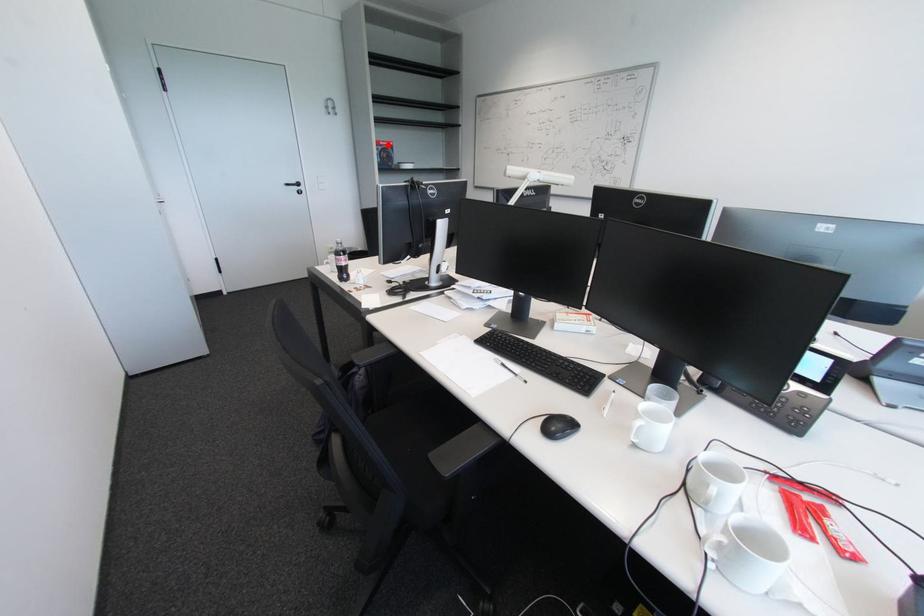
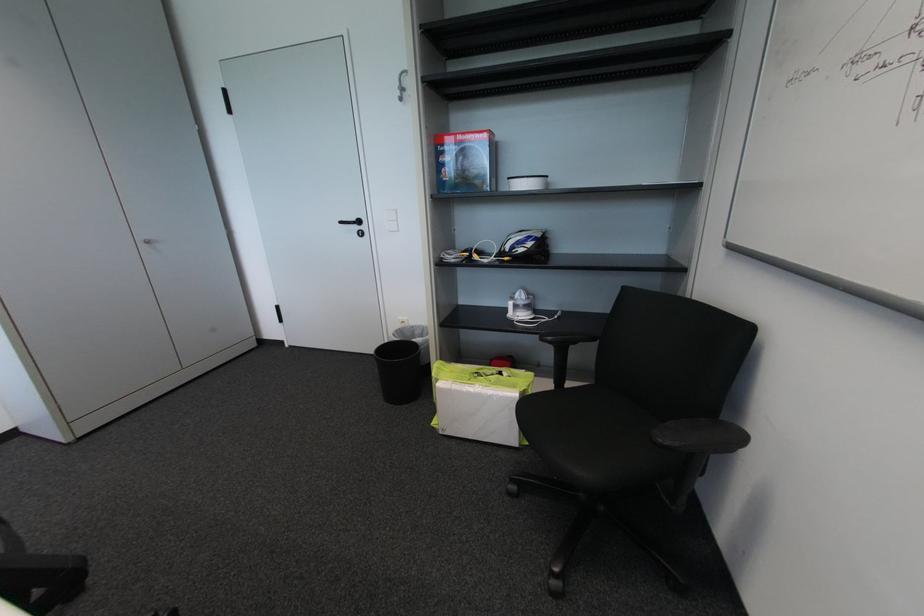
Question: I am providing you with two images of the same scene from different viewpoints. Image1 has a red point marked. In image2, the corresponding 3D location appears at what relative position? Reply with the corresponding letter.

Choices:
 (A) Closer
 (B) Farther

Answer: (B)